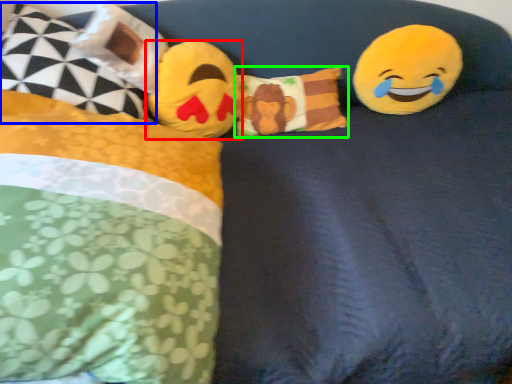
Question: Based on their relative distances, which object is nearer to toy (highlighted by a red box)? Choose from pillow (highlighted by a blue box) and pillow (highlighted by a green box).

Choices:
 (A) pillow
 (B) pillow

Answer: (B)